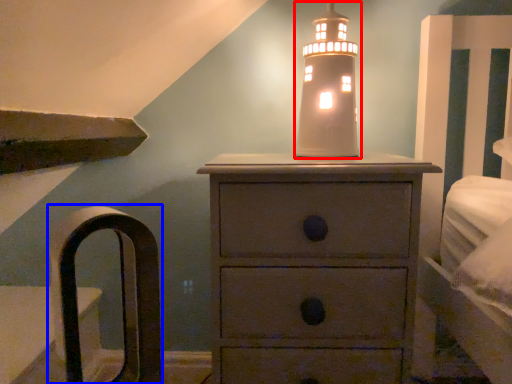
Question: Which object appears farthest to the camera in this image, candle holder (highlighted by a red box) or armchair (highlighted by a blue box)?

Choices:
 (A) candle holder
 (B) armchair

Answer: (A)